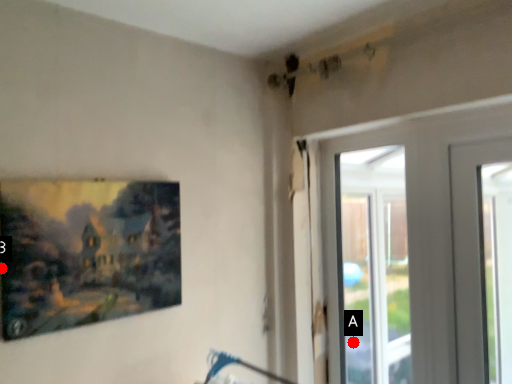
Question: Two points are circled on the image, labeled by A and B beside each circle. Which point is closer to the camera?

Choices:
 (A) A is closer
 (B) B is closer

Answer: (B)